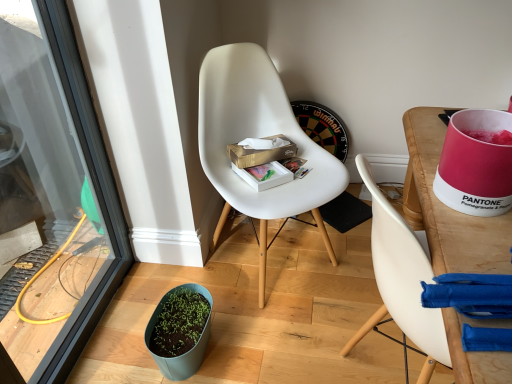
Based on the photo, what is the approximate width of transparent glass screen door at lower left?

The width of transparent glass screen door at lower left is 9.54 centimeters.

Image resolution: width=512 pixels, height=384 pixels. I want to click on transparent glass screen door at lower left, so click(x=52, y=200).

What is the approximate width of green matte flowerpot at lower left?

green matte flowerpot at lower left is 7.84 inches wide.

Locate an element on the screen. The width and height of the screenshot is (512, 384). gold cardboard tissue box at center, the first box viewed from the top is located at coordinates (260, 153).

From a real-world perspective, who is located lower, transparent glass screen door at lower left or wooden desk at right?

From a 3D spatial view, wooden desk at right is below.

Does transparent glass screen door at lower left turn towards wooden desk at right?

Yes, transparent glass screen door at lower left faces towards wooden desk at right.

Would you say transparent glass screen door at lower left is inside or outside wooden desk at right?

transparent glass screen door at lower left is spatially situated outside wooden desk at right.

Which is closer to the camera, (191, 359) or (260, 206)?

Point (191, 359) is closer to the camera than point (260, 206).

Considering the positions of objects green matte flowerpot at lower left and white matte chair at center in the image provided, who is behind, green matte flowerpot at lower left or white matte chair at center?

green matte flowerpot at lower left is more distant.

Is green matte flowerpot at lower left with white matte chair at center?

No, green matte flowerpot at lower left is not in contact with white matte chair at center.

How many degrees apart are the facing directions of green matte flowerpot at lower left and white matte chair at center?

The angular difference between green matte flowerpot at lower left and white matte chair at center is 42.6 degrees.

Visually, is gold cardboard tissue box at center, the first box viewed from the top, positioned to the left or to the right of transparent glass screen door at lower left?

gold cardboard tissue box at center, the first box viewed from the top, is positioned on transparent glass screen door at lower left's right side.

Which is behind, gold cardboard tissue box at center, the second box from the bottom, or transparent glass screen door at lower left?

Positioned behind is gold cardboard tissue box at center, the second box from the bottom.

You are a GUI agent. You are given a task and a screenshot of the screen. Output one action in this format:
    pyautogui.click(x=<x>, y=<y>)
    Task: Click on the screen door above the gold cardboard tissue box at center, the second box from the bottom (from a real-world perspective)
    The height and width of the screenshot is (384, 512).
    Given the screenshot: What is the action you would take?
    pyautogui.click(x=52, y=200)

In terms of size, does gold cardboard tissue box at center, the second box from the bottom, appear bigger or smaller than transparent glass screen door at lower left?

Clearly, gold cardboard tissue box at center, the second box from the bottom, is smaller in size than transparent glass screen door at lower left.

Is wooden desk at right facing towards transparent glass screen door at lower left?

No, wooden desk at right is not facing towards transparent glass screen door at lower left.

This screenshot has height=384, width=512. Identify the location of desk lying on the right of transparent glass screen door at lower left. (448, 207).

From a real-world perspective, between wooden desk at right and transparent glass screen door at lower left, who is vertically higher?

In real-world perspective, transparent glass screen door at lower left is above.

From the image's perspective, is wooden desk at right above white matte box at center, which appears as the second box when viewed from the top?

Actually, wooden desk at right appears below white matte box at center, which appears as the second box when viewed from the top, in the image.

Considering the sizes of objects wooden desk at right and white matte box at center, placed as the 1th box when sorted from bottom to top, in the image provided, who is taller, wooden desk at right or white matte box at center, placed as the 1th box when sorted from bottom to top,?

wooden desk at right.

From the picture: Between wooden desk at right and white matte box at center, which appears as the second box when viewed from the top, which one is positioned behind?

white matte box at center, which appears as the second box when viewed from the top, is further from the camera.

Is there a large distance between wooden desk at right and white matte box at center, placed as the 1th box when sorted from bottom to top?

They are positioned close to each other.

Does white matte box at center, which appears as the second box when viewed from the top, have a lesser width compared to gold cardboard tissue box at center, the first box viewed from the top?

No.

Based on the photo, is white matte box at center, placed as the 1th box when sorted from bottom to top, smaller than gold cardboard tissue box at center, the first box viewed from the top?

Yes.

Is white matte box at center, which appears as the second box when viewed from the top, not close to gold cardboard tissue box at center, the second box from the bottom?

That's not correct — white matte box at center, which appears as the second box when viewed from the top, is a little close to gold cardboard tissue box at center, the second box from the bottom.

Is white matte box at center, which appears as the second box when viewed from the top, situated inside gold cardboard tissue box at center, the second box from the bottom, or outside?

white matte box at center, which appears as the second box when viewed from the top, is located beyond the bounds of gold cardboard tissue box at center, the second box from the bottom.

Which is nearer, (233, 162) or (271, 173)?

Point (233, 162) appears to be farther away from the viewer than point (271, 173).

From the image's perspective, is gold cardboard tissue box at center, the first box viewed from the top, positioned above or below white matte box at center, placed as the 1th box when sorted from bottom to top?

gold cardboard tissue box at center, the first box viewed from the top, is above white matte box at center, placed as the 1th box when sorted from bottom to top.

Can you confirm if gold cardboard tissue box at center, the first box viewed from the top, is positioned to the left of white matte box at center, placed as the 1th box when sorted from bottom to top?

Correct, you'll find gold cardboard tissue box at center, the first box viewed from the top, to the left of white matte box at center, placed as the 1th box when sorted from bottom to top.

Where is `box located above the white matte box at center, which appears as the second box when viewed from the top (from the image's perspective)`? This screenshot has height=384, width=512. box located above the white matte box at center, which appears as the second box when viewed from the top (from the image's perspective) is located at coordinates (260, 153).

The image size is (512, 384). Find the location of `screen door behind the wooden desk at right`. screen door behind the wooden desk at right is located at coordinates [52, 200].

Find the location of a particular element. chair that is above the green matte flowerpot at lower left (from a real-world perspective) is located at coordinates (258, 137).

In the scene shown: Looking at the image, which one is located closer to transparent glass screen door at lower left, white matte box at center, which appears as the second box when viewed from the top, or wooden desk at right?

white matte box at center, which appears as the second box when viewed from the top, is closer to transparent glass screen door at lower left.

From the image, which object appears to be nearer to white matte chair at center, wooden desk at right or gold cardboard tissue box at center, the second box from the bottom?

The object closer to white matte chair at center is gold cardboard tissue box at center, the second box from the bottom.

Based on their spatial positions, is transparent glass screen door at lower left or gold cardboard tissue box at center, the first box viewed from the top, further from white matte box at center, which appears as the second box when viewed from the top?

Based on the image, transparent glass screen door at lower left appears to be further to white matte box at center, which appears as the second box when viewed from the top.

Based on their spatial positions, is gold cardboard tissue box at center, the second box from the bottom, or white matte box at center, placed as the 1th box when sorted from bottom to top, closer to transparent glass screen door at lower left?

Based on the image, gold cardboard tissue box at center, the second box from the bottom, appears to be nearer to transparent glass screen door at lower left.

From the image, which object appears to be nearer to gold cardboard tissue box at center, the first box viewed from the top, transparent glass screen door at lower left or wooden desk at right?

The object closer to gold cardboard tissue box at center, the first box viewed from the top, is wooden desk at right.

Based on their spatial positions, is white matte box at center, which appears as the second box when viewed from the top, or white matte chair at center further from transparent glass screen door at lower left?

The object further to transparent glass screen door at lower left is white matte box at center, which appears as the second box when viewed from the top.

Looking at the image, which one is located further to white matte box at center, placed as the 1th box when sorted from bottom to top, gold cardboard tissue box at center, the first box viewed from the top, or white matte chair at center?

white matte chair at center lies further to white matte box at center, placed as the 1th box when sorted from bottom to top, than the other object.

Which object lies nearer to the anchor point green matte flowerpot at lower left, wooden desk at right or white matte chair at center?

Among the two, white matte chair at center is located nearer to green matte flowerpot at lower left.

You are a GUI agent. You are given a task and a screenshot of the screen. Output one action in this format:
    pyautogui.click(x=<x>, y=<y>)
    Task: Click on the flowerpot between transparent glass screen door at lower left and white matte chair at center in the horizontal direction
    The width and height of the screenshot is (512, 384).
    Given the screenshot: What is the action you would take?
    pyautogui.click(x=185, y=358)

Find the location of a particular element. This screenshot has width=512, height=384. chair between wooden desk at right and gold cardboard tissue box at center, the first box viewed from the top, in the front-back direction is located at coordinates (258, 137).

Where is `chair between green matte flowerpot at lower left and wooden desk at right in the horizontal direction`? The height and width of the screenshot is (384, 512). chair between green matte flowerpot at lower left and wooden desk at right in the horizontal direction is located at coordinates (258, 137).

The image size is (512, 384). Identify the location of flowerpot situated between transparent glass screen door at lower left and wooden desk at right from left to right. (185, 358).